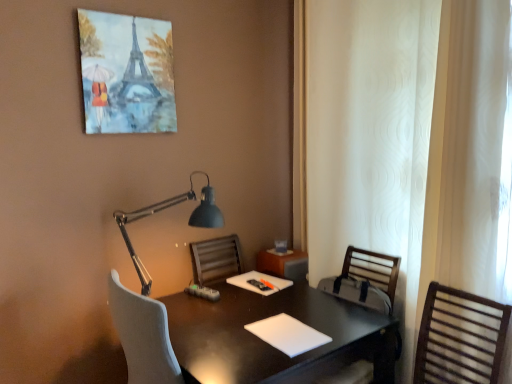
Find the location of a particular element. This screenshot has width=512, height=384. unoccupied area in front of white matte notepad at center, acting as the first notepad starting from the back is located at coordinates (263, 302).